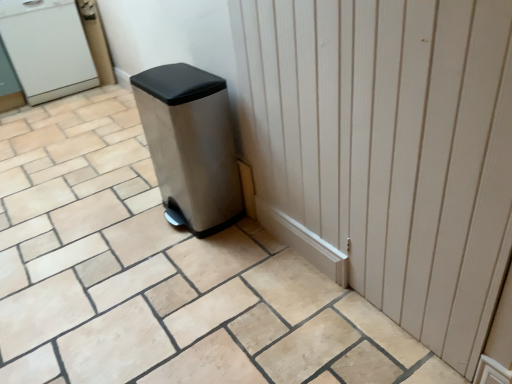
Question: Could you tell me if white matte water cooler at upper left is facing stainless steel trash can at center?

Choices:
 (A) yes
 (B) no

Answer: (A)

Question: Is white matte water cooler at upper left to the right of stainless steel trash can at center from the viewer's perspective?

Choices:
 (A) yes
 (B) no

Answer: (B)

Question: Is white matte water cooler at upper left far from stainless steel trash can at center?

Choices:
 (A) no
 (B) yes

Answer: (B)

Question: From the image's perspective, is white matte water cooler at upper left located above stainless steel trash can at center?

Choices:
 (A) no
 (B) yes

Answer: (B)

Question: Is white matte water cooler at upper left at the left side of stainless steel trash can at center?

Choices:
 (A) no
 (B) yes

Answer: (B)

Question: Is white matte water cooler at upper left further to camera compared to stainless steel trash can at center?

Choices:
 (A) no
 (B) yes

Answer: (B)

Question: Does white wood door at center come behind beige ceramic tile at center?

Choices:
 (A) yes
 (B) no

Answer: (A)

Question: Does white wood door at center touch beige ceramic tile at center?

Choices:
 (A) yes
 (B) no

Answer: (B)

Question: Could you tell me if white wood door at center is turned towards beige ceramic tile at center?

Choices:
 (A) yes
 (B) no

Answer: (B)

Question: From a real-world perspective, is white wood door at center on top of beige ceramic tile at center?

Choices:
 (A) yes
 (B) no

Answer: (A)

Question: Is white wood door at center at the right side of beige ceramic tile at center?

Choices:
 (A) yes
 (B) no

Answer: (A)

Question: Is white wood door at center completely or partially outside of beige ceramic tile at center?

Choices:
 (A) yes
 (B) no

Answer: (A)

Question: Is stainless steel trash can at center positioned with its back to white matte water cooler at upper left?

Choices:
 (A) yes
 (B) no

Answer: (B)